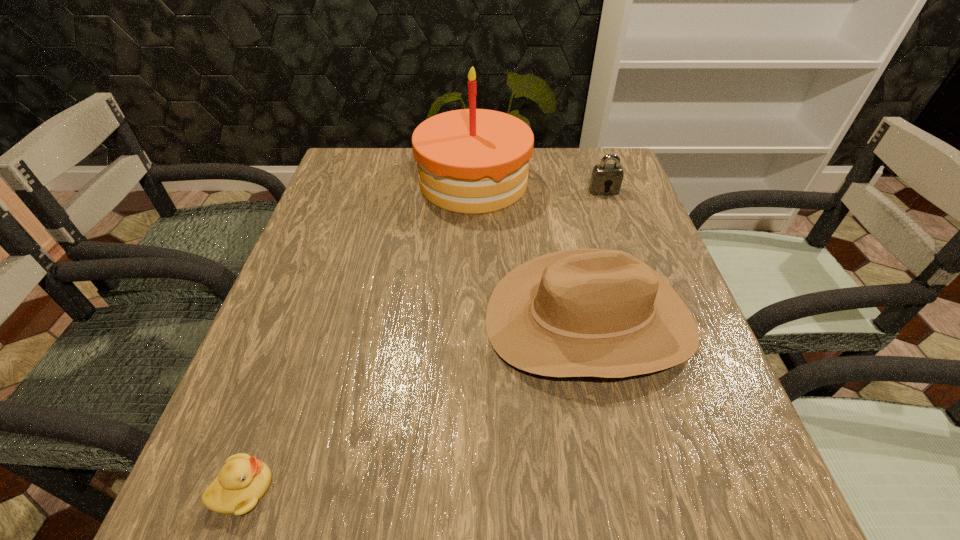
This screenshot has height=540, width=960. I want to click on birthday cake located in the far edge section of the desktop, so click(472, 161).

You are a GUI agent. You are given a task and a screenshot of the screen. Output one action in this format:
    pyautogui.click(x=<x>, y=<y>)
    Task: Click on the padlock located in the far edge section of the desktop
    This screenshot has width=960, height=540.
    Given the screenshot: What is the action you would take?
    pyautogui.click(x=605, y=177)

Where is `object present at the near edge`? object present at the near edge is located at coordinates (243, 480).

I want to click on object that is positioned at the left edge, so click(x=243, y=480).

You are a GUI agent. You are given a task and a screenshot of the screen. Output one action in this format:
    pyautogui.click(x=<x>, y=<y>)
    Task: Click on the cowboy hat that is at the right edge
    The image size is (960, 540).
    Given the screenshot: What is the action you would take?
    pyautogui.click(x=581, y=312)

I want to click on padlock positioned at the right edge, so click(x=605, y=177).

At what (x,y) coordinates should I click in order to perform the action: click on object at the near left corner. Please return your answer as a coordinate pair (x, y). This screenshot has width=960, height=540. Looking at the image, I should click on pos(243,480).

Where is `object at the far right corner`? This screenshot has height=540, width=960. object at the far right corner is located at coordinates (605, 177).

Image resolution: width=960 pixels, height=540 pixels. What are the coordinates of `vacant region at the far edge of the desktop` in the screenshot? It's located at (417, 178).

Identify the location of vacant area at the near edge. The image size is (960, 540). (586, 485).